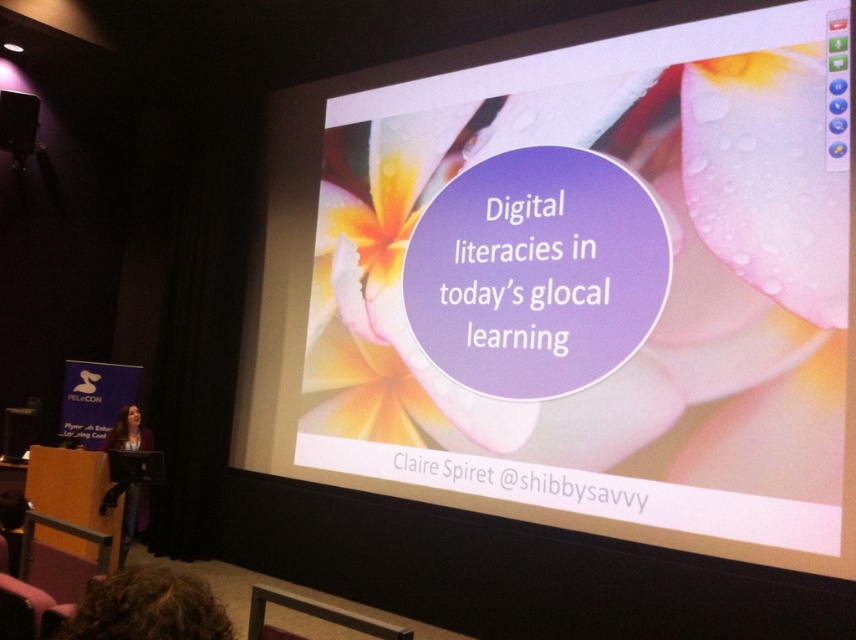
Question: From the image, what is the correct spatial relationship of curly hair at lower left in relation to matte black podium at left?

Choices:
 (A) above
 (B) below

Answer: (B)

Question: Which object is closer to the camera taking this photo?

Choices:
 (A) matte black podium at left
 (B) curly hair at lower left
 (C) white glossy projection screen at upper center

Answer: (B)

Question: Which of the following is the farthest from the observer?

Choices:
 (A) (3, 113)
 (B) (229, 620)
 (C) (147, 518)
 (D) (349, 148)

Answer: (A)

Question: From the image, what is the correct spatial relationship of white glossy projection screen at upper center in relation to dark purple sweater at lower left?

Choices:
 (A) right
 (B) left

Answer: (A)

Question: Does white glossy projection screen at upper center lie in front of matte black podium at left?

Choices:
 (A) yes
 (B) no

Answer: (A)

Question: Which point is closer to the camera taking this photo?

Choices:
 (A) (88, 588)
 (B) (262, 410)
 (C) (34, 116)
 (D) (123, 436)

Answer: (A)